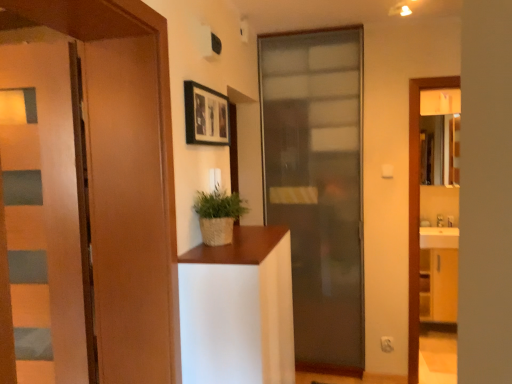
Question: Is black matte picture frame at upper center spatially inside wooden door at left, which is the 2th door in front-to-back order, or outside of it?

Choices:
 (A) inside
 (B) outside

Answer: (B)

Question: In the image, is black matte picture frame at upper center positioned in front of or behind wooden door at left, arranged as the 1th door when viewed from the left?

Choices:
 (A) behind
 (B) front

Answer: (A)

Question: Which object is positioned farthest from the black matte picture frame at upper center?

Choices:
 (A) white matte cabinet at center
 (B) wooden door at left, arranged as the 1th door when viewed from the left
 (C) matte brown door at left, marked as the third door in a back-to-front arrangement
 (D) braided straw pot at center
 (E) translucent glass door at center, acting as the 1th door starting from the right

Answer: (E)

Question: Which of these objects is positioned closest to the matte brown door at left, marked as the third door in a back-to-front arrangement?

Choices:
 (A) translucent glass door at center, arranged as the 3th door when viewed from the front
 (B) black matte picture frame at upper center
 (C) wooden door at left, the third door positioned from the right
 (D) white matte cabinet at center
 (E) braided straw pot at center

Answer: (C)